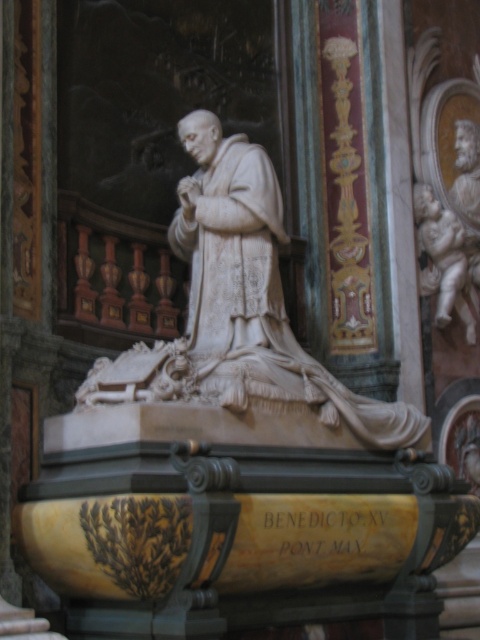
Question: Which point appears farthest from the camera in this image?

Choices:
 (A) (432, 227)
 (B) (218, 205)

Answer: (A)

Question: Can you confirm if white marble statue at center is wider than white marble cherub at upper right?

Choices:
 (A) yes
 (B) no

Answer: (A)

Question: Does white marble statue at center appear on the right side of white marble cherub at upper right?

Choices:
 (A) yes
 (B) no

Answer: (B)

Question: Which point is closer to the camera?

Choices:
 (A) white marble statue at center
 (B) white marble cherub at upper right

Answer: (A)

Question: Does white marble statue at center come in front of white marble cherub at upper right?

Choices:
 (A) no
 (B) yes

Answer: (B)